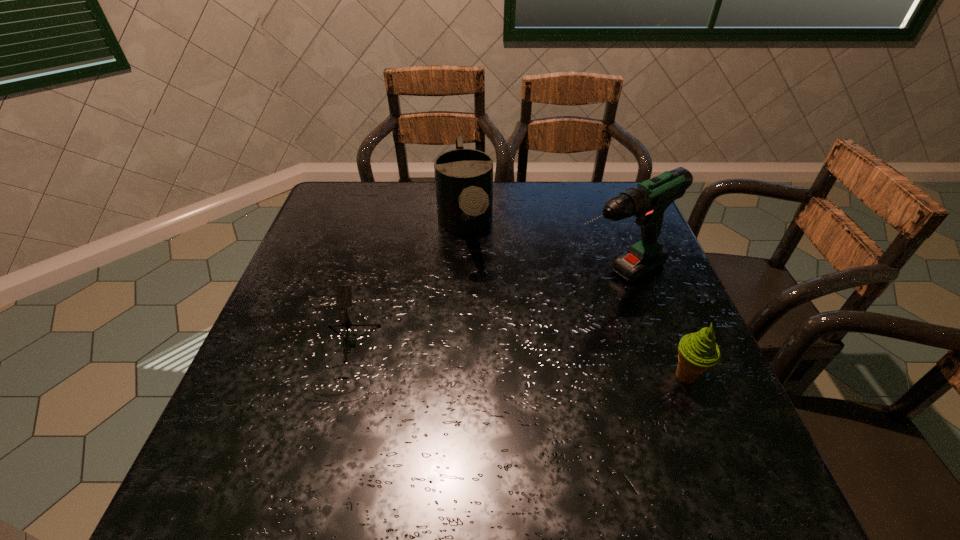
Identify the location of vacant space on the desktop that is between the shortest object and the icecream and is positioned with the spout on the third object from right to left. The height and width of the screenshot is (540, 960). (491, 367).

Identify the location of free space on the desktop that is between the microphone and the icecream and is positioned on the handle side of the tallest object. This screenshot has height=540, width=960. (461, 365).